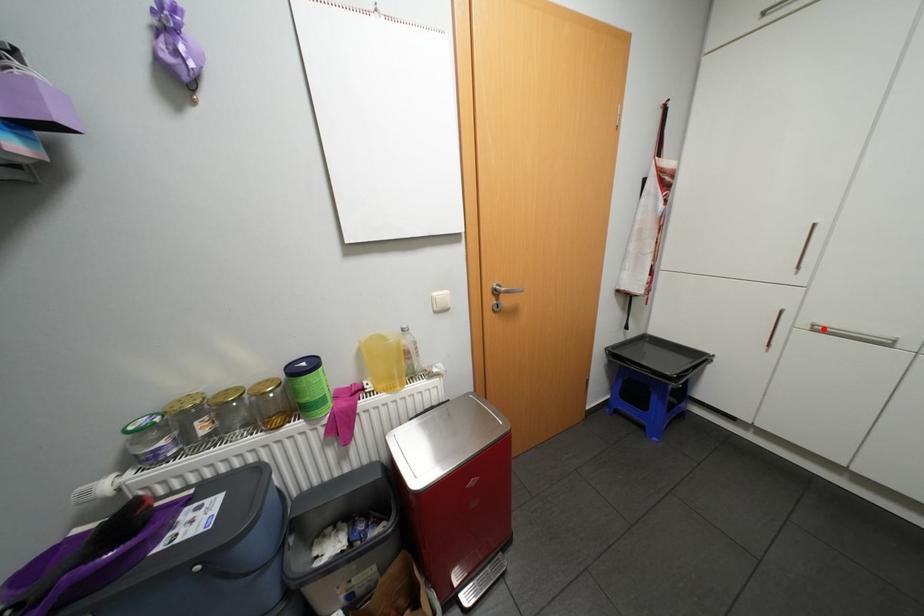
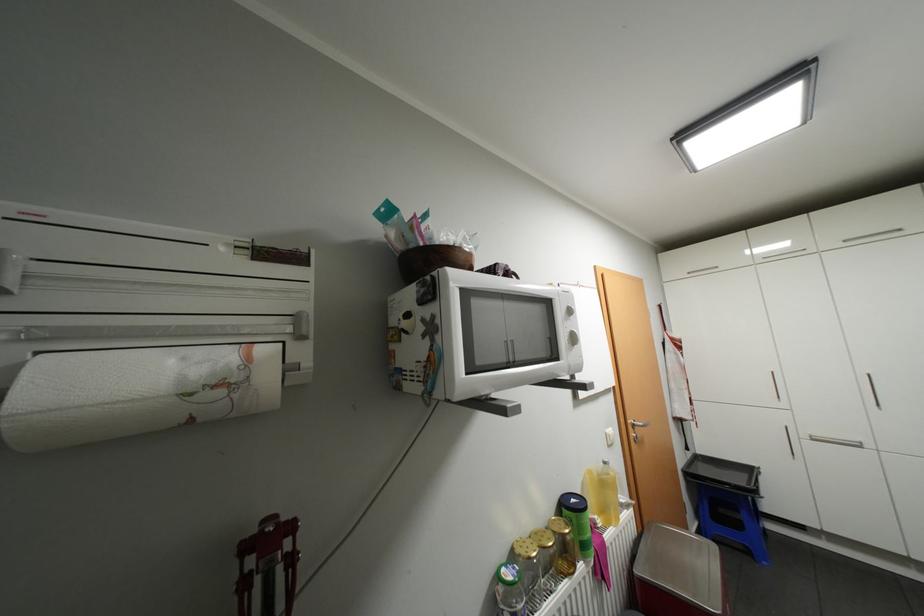
In the second image, find the point that corresponds to the highlighted location in the first image.

(821, 438)